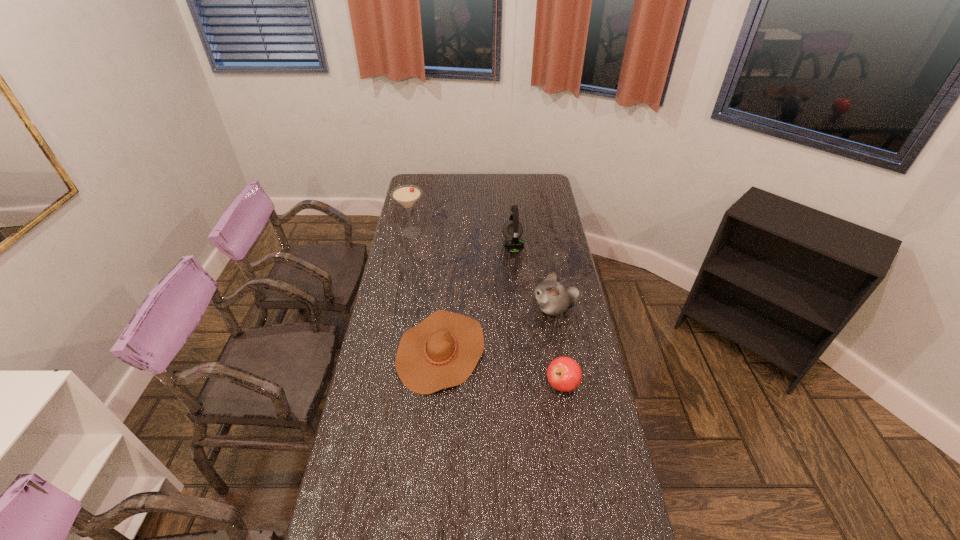
Where is `free point between the third object from right to left and the cowboy hat`? free point between the third object from right to left and the cowboy hat is located at coordinates (477, 298).

Where is `free space between the cowboy hat and the third object from right to left`? The image size is (960, 540). free space between the cowboy hat and the third object from right to left is located at coordinates point(477,298).

You are a GUI agent. You are given a task and a screenshot of the screen. Output one action in this format:
    pyautogui.click(x=<x>, y=<y>)
    Task: Click on the closest object to the fourth tallest object
    
    Given the screenshot: What is the action you would take?
    pyautogui.click(x=442, y=351)

Find the location of a particular element. The image size is (960, 540). object identified as the second closest to the martini is located at coordinates (442, 351).

Find the location of a particular element. Image resolution: width=960 pixels, height=540 pixels. vacant space that satisfies the following two spatial constraints: 1. on the back side of the fourth tallest object; 2. on the ear cups of the headset is located at coordinates (540, 245).

Identify the location of free spot that satisfies the following two spatial constraints: 1. on the front side of the fourth tallest object; 2. on the left side of the martini. This screenshot has height=540, width=960. (382, 384).

The width and height of the screenshot is (960, 540). I want to click on blank area in the image that satisfies the following two spatial constraints: 1. on the ear cups of the third object from left to right; 2. on the back side of the apple, so click(x=525, y=384).

The height and width of the screenshot is (540, 960). Find the location of `free space that satisfies the following two spatial constraints: 1. on the ear cups of the apple; 2. on the left side of the third object from left to right`. free space that satisfies the following two spatial constraints: 1. on the ear cups of the apple; 2. on the left side of the third object from left to right is located at coordinates (525, 384).